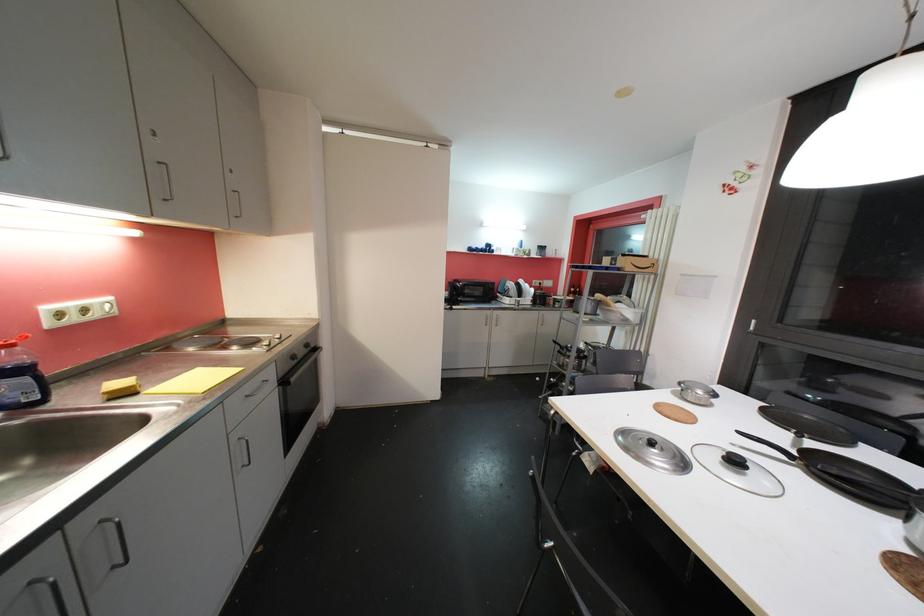
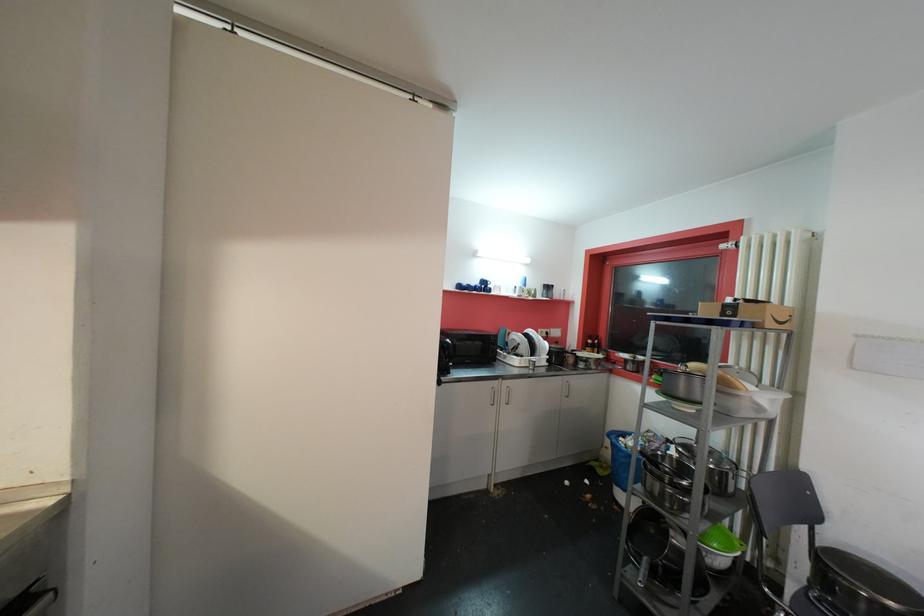
Locate, in the second image, the point that corresponds to (x=493, y=248) in the first image.

(489, 285)